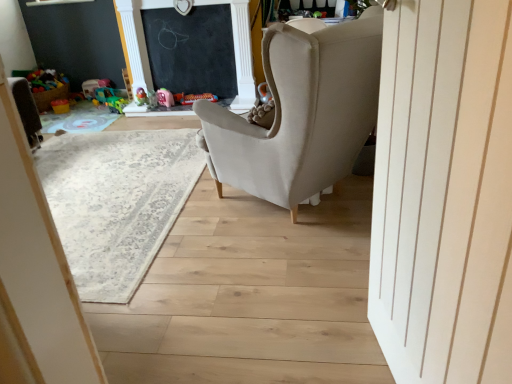
This screenshot has height=384, width=512. In order to click on beige carpet at center in this screenshot , I will do `click(116, 202)`.

What do you see at coordinates (116, 104) in the screenshot?
I see `rubberized green toy at center, the second toy in the left-to-right sequence` at bounding box center [116, 104].

What do you see at coordinates (60, 106) in the screenshot?
I see `matte orange toy at center, placed as the sixth toy when sorted from right to left` at bounding box center [60, 106].

At what (x,y) coordinates should I click in order to perform the action: click on matte plastic toy at center, marked as the fifth toy in a left-to-right arrangement. Please return your answer as a coordinate pair (x, y). The image size is (512, 384). Looking at the image, I should click on (193, 98).

Describe the element at coordinates (193, 98) in the screenshot. This screenshot has width=512, height=384. I see `matte plastic toy at center, marked as the fifth toy in a left-to-right arrangement` at that location.

Measure the distance between black chalkboard at upper center and camera.

The depth of black chalkboard at upper center is 4.03 meters.

You are a GUI agent. You are given a task and a screenshot of the screen. Output one action in this format:
    pyautogui.click(x=<x>, y=<y>)
    Task: Click on the black chalkboard at upper center
    
    Given the screenshot: What is the action you would take?
    pyautogui.click(x=240, y=52)

Image resolution: width=512 pixels, height=384 pixels. Find the location of `rubberized green toy at upper left, which is counted as the 3th toy, starting from the left`. rubberized green toy at upper left, which is counted as the 3th toy, starting from the left is located at coordinates (141, 97).

Image resolution: width=512 pixels, height=384 pixels. I want to click on the 2nd toy positioned below the black chalkboard at upper center (from the image's perspective), so click(141, 97).

Considering the sizes of objects rubberized green toy at upper left, which is counted as the 3th toy, starting from the left, and black chalkboard at upper center in the image provided, who is taller, rubberized green toy at upper left, which is counted as the 3th toy, starting from the left, or black chalkboard at upper center?

With more height is black chalkboard at upper center.

Which is in front, point (145, 95) or point (240, 87)?

Point (145, 95)

Is rubberized green toy at upper left, the 4th toy in the right-to-left sequence, located outside black chalkboard at upper center?

Yes, rubberized green toy at upper left, the 4th toy in the right-to-left sequence, is located beyond the bounds of black chalkboard at upper center.

Is the surface of pink rubber duck at upper center, which is the third toy in right-to-left order, in direct contact with beige carpet at center?

They are not placed beside each other.

Does pink rubber duck at upper center, which is the third toy in right-to-left order, have a lesser height compared to beige carpet at center?

Incorrect, the height of pink rubber duck at upper center, which is the third toy in right-to-left order, does not fall short of that of beige carpet at center.

Is pink rubber duck at upper center, which is the third toy in right-to-left order, at the right side of beige carpet at center?

Yes, pink rubber duck at upper center, which is the third toy in right-to-left order, is to the right of beige carpet at center.

Which is in front, point (144, 103) or point (258, 92)?

The point (144, 103) is more forward.

Is rubberized green toy at upper left, which is counted as the 3th toy, starting from the left, smaller than matte gray plush toy at upper center, which is the 6th toy from left to right?

Yes.

Is rubberized green toy at upper left, the 4th toy in the right-to-left sequence, aimed at matte gray plush toy at upper center, the 1th toy from the right?

No.

Between rubberized green toy at upper left, which is counted as the 3th toy, starting from the left, and rubberized green toy at center, the second toy in the left-to-right sequence, which one has larger width?

Wider between the two is rubberized green toy at upper left, which is counted as the 3th toy, starting from the left.

Is point (136, 96) less distant than point (117, 99)?

Yes, point (136, 96) is closer to viewer.

Would you consider rubberized green toy at upper left, which is counted as the 3th toy, starting from the left, to be distant from rubberized green toy at center, which is the fifth toy in right-to-left order?

rubberized green toy at upper left, which is counted as the 3th toy, starting from the left, is actually quite close to rubberized green toy at center, which is the fifth toy in right-to-left order.

Do you think rubberized green toy at upper left, the 4th toy in the right-to-left sequence, is within rubberized green toy at center, which is the fifth toy in right-to-left order, or outside of it?

The correct answer is: outside.

Is pink rubber duck at upper center, which is the third toy in right-to-left order, facing towards rubberized green toy at center, the second toy in the left-to-right sequence?

No, pink rubber duck at upper center, which is the third toy in right-to-left order, is not facing towards rubberized green toy at center, the second toy in the left-to-right sequence.

Choose the correct answer: Is pink rubber duck at upper center, which is the third toy in right-to-left order, inside rubberized green toy at center, the second toy in the left-to-right sequence, or outside it?

pink rubber duck at upper center, which is the third toy in right-to-left order, is not enclosed by rubberized green toy at center, the second toy in the left-to-right sequence.

Which object is further away from the camera, pink rubber duck at upper center, which is the third toy in right-to-left order, or rubberized green toy at center, the second toy in the left-to-right sequence?

rubberized green toy at center, the second toy in the left-to-right sequence, is more distant.

Where is `toy located below the pink rubber duck at upper center, which is the third toy in right-to-left order (from the image's perspective)`? toy located below the pink rubber duck at upper center, which is the third toy in right-to-left order (from the image's perspective) is located at coordinates (116, 104).

Is black chalkboard at upper center facing away from rubberized green toy at upper left, the 4th toy in the right-to-left sequence?

black chalkboard at upper center is not turned away from rubberized green toy at upper left, the 4th toy in the right-to-left sequence.

From a real-world perspective, is black chalkboard at upper center positioned over rubberized green toy at upper left, which is counted as the 3th toy, starting from the left, based on gravity?

A: Yes, from a real-world perspective, black chalkboard at upper center is above rubberized green toy at upper left, which is counted as the 3th toy, starting from the left.

The image size is (512, 384). Identify the location of fireplace above the rubberized green toy at upper left, the 4th toy in the right-to-left sequence (from a real-world perspective). (240, 52).

Consider the image. From the image's perspective, who appears lower, black chalkboard at upper center or rubberized green toy at upper left, the 4th toy in the right-to-left sequence?

rubberized green toy at upper left, the 4th toy in the right-to-left sequence, is shown below in the image.

Is matte gray plush toy at upper center, the 1th toy from the right, far from matte plastic toy at center, marked as the fifth toy in a left-to-right arrangement?

No, matte gray plush toy at upper center, the 1th toy from the right, is not far from matte plastic toy at center, marked as the fifth toy in a left-to-right arrangement.

Looking at the image, does matte gray plush toy at upper center, the 1th toy from the right, seem bigger or smaller compared to matte plastic toy at center, which ranks as the second toy in right-to-left order?

matte gray plush toy at upper center, the 1th toy from the right, is smaller than matte plastic toy at center, which ranks as the second toy in right-to-left order.

Is matte gray plush toy at upper center, which is the 6th toy from left to right, oriented towards matte plastic toy at center, which ranks as the second toy in right-to-left order?

No, matte gray plush toy at upper center, which is the 6th toy from left to right, is not oriented towards matte plastic toy at center, which ranks as the second toy in right-to-left order.

From a real-world perspective, which toy is the 1st one above the matte plastic toy at center, marked as the fifth toy in a left-to-right arrangement? Please provide its 2D coordinates.

[(264, 93)]

The height and width of the screenshot is (384, 512). In order to click on fireplace located on the right of rubberized green toy at upper left, which is counted as the 3th toy, starting from the left in this screenshot , I will do click(x=240, y=52).

There is a beige carpet at center. Where is `the 2nd toy above it (from the image's perspective)`? The height and width of the screenshot is (384, 512). the 2nd toy above it (from the image's perspective) is located at coordinates (165, 97).

From the picture: When comparing their distances from matte plastic toy at center, which ranks as the second toy in right-to-left order, does rubberized green toy at center, the second toy in the left-to-right sequence, or matte orange toy at center, placed as the sixth toy when sorted from right to left, seem further?

matte orange toy at center, placed as the sixth toy when sorted from right to left.

Which object lies nearer to the anchor point matte plastic toy at center, which ranks as the second toy in right-to-left order, matte orange toy at center, placed as the sixth toy when sorted from right to left, or black chalkboard at upper center?

black chalkboard at upper center lies closer to matte plastic toy at center, which ranks as the second toy in right-to-left order, than the other object.

When comparing their distances from rubberized green toy at upper left, the 4th toy in the right-to-left sequence, does rubberized green toy at center, the second toy in the left-to-right sequence, or black chalkboard at upper center seem closer?

The object closer to rubberized green toy at upper left, the 4th toy in the right-to-left sequence, is rubberized green toy at center, the second toy in the left-to-right sequence.

Which object lies nearer to the anchor point beige carpet at center, matte orange toy at center, placed as the sixth toy when sorted from right to left, or rubberized green toy at upper left, the 4th toy in the right-to-left sequence?

Among the two, rubberized green toy at upper left, the 4th toy in the right-to-left sequence, is located nearer to beige carpet at center.

Which object lies further to the anchor point rubberized green toy at center, the second toy in the left-to-right sequence, matte plastic toy at center, which ranks as the second toy in right-to-left order, or matte orange toy at center, the 1th toy from the left?

matte plastic toy at center, which ranks as the second toy in right-to-left order, is further to rubberized green toy at center, the second toy in the left-to-right sequence.

Based on their spatial positions, is beige carpet at center or matte gray plush toy at upper center, which is the 6th toy from left to right, further from rubberized green toy at upper left, which is counted as the 3th toy, starting from the left?

beige carpet at center is positioned further to the anchor rubberized green toy at upper left, which is counted as the 3th toy, starting from the left.

Looking at the image, which one is located closer to pink rubber duck at upper center, which is the fourth toy from left to right, beige carpet at center or matte orange toy at center, the 1th toy from the left?

matte orange toy at center, the 1th toy from the left, is closer to pink rubber duck at upper center, which is the fourth toy from left to right.

From the image, which object appears to be farther from black chalkboard at upper center, rubberized green toy at center, the second toy in the left-to-right sequence, or rubberized green toy at upper left, which is counted as the 3th toy, starting from the left?

rubberized green toy at center, the second toy in the left-to-right sequence, is positioned further to the anchor black chalkboard at upper center.

This screenshot has width=512, height=384. Find the location of `fireplace between beige carpet at center and matte orange toy at center, the 1th toy from the left, from front to back`. fireplace between beige carpet at center and matte orange toy at center, the 1th toy from the left, from front to back is located at coordinates (240, 52).

This screenshot has width=512, height=384. Find the location of `fireplace between matte orange toy at center, the 1th toy from the left, and matte plastic toy at center, which ranks as the second toy in right-to-left order, in the horizontal direction`. fireplace between matte orange toy at center, the 1th toy from the left, and matte plastic toy at center, which ranks as the second toy in right-to-left order, in the horizontal direction is located at coordinates (240, 52).

Where is `fireplace located between beige carpet at center and rubberized green toy at center, the second toy in the left-to-right sequence, in the depth direction`? fireplace located between beige carpet at center and rubberized green toy at center, the second toy in the left-to-right sequence, in the depth direction is located at coordinates (240, 52).

The width and height of the screenshot is (512, 384). Find the location of `fireplace between rubberized green toy at center, the second toy in the left-to-right sequence, and matte gray plush toy at upper center, which is the 6th toy from left to right`. fireplace between rubberized green toy at center, the second toy in the left-to-right sequence, and matte gray plush toy at upper center, which is the 6th toy from left to right is located at coordinates (x=240, y=52).